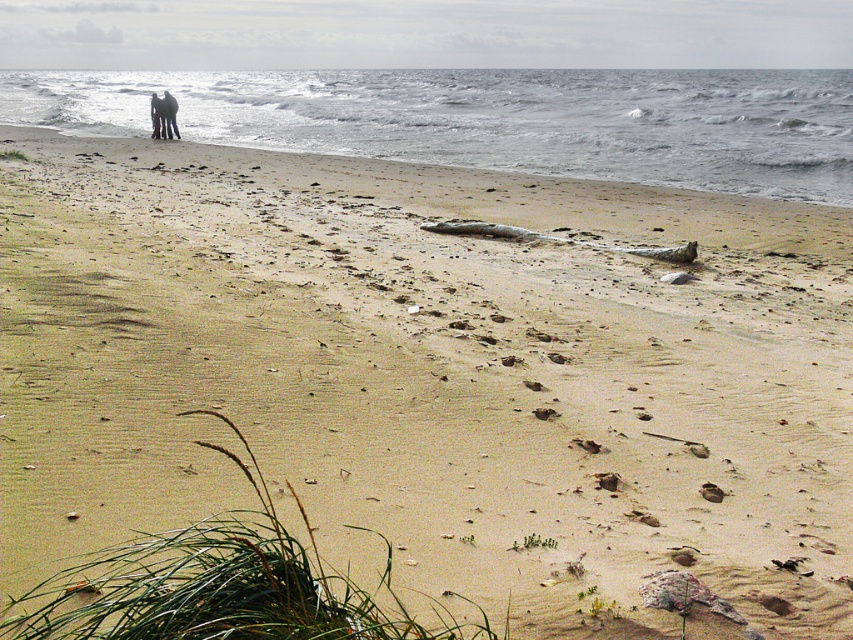
You are a photographer planning to capture the dark clothing couple at upper left and the dark gray fabric pants at upper left in a single shot. Based on their sizes, which one would you need to position closer to the camera to ensure both fit within the frame?

The dark clothing couple at upper left is wider than the dark gray fabric pants at upper left, so you should position the dark clothing couple at upper left closer to the camera to ensure both fit within the frame.

You are a photographer trying to capture the two figures in the scene. The gray water at upper left and dark gray fabric pants at upper left are both in your viewfinder. Which object is positioned higher in the frame?

The gray water at upper left is taller than dark gray fabric pants at upper left, so it is positioned higher in the frame.